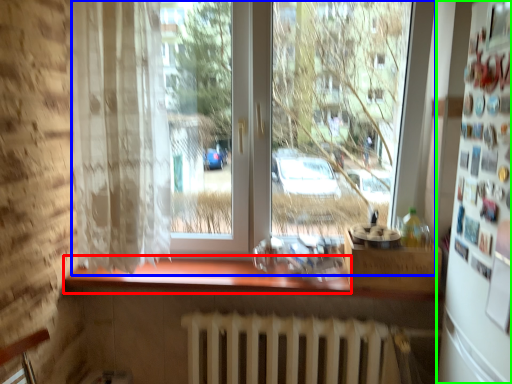
Question: Considering the real-world distances, which object is farthest from counter top (highlighted by a red box)? window (highlighted by a blue box) or fridge (highlighted by a green box)?

Choices:
 (A) window
 (B) fridge

Answer: (B)